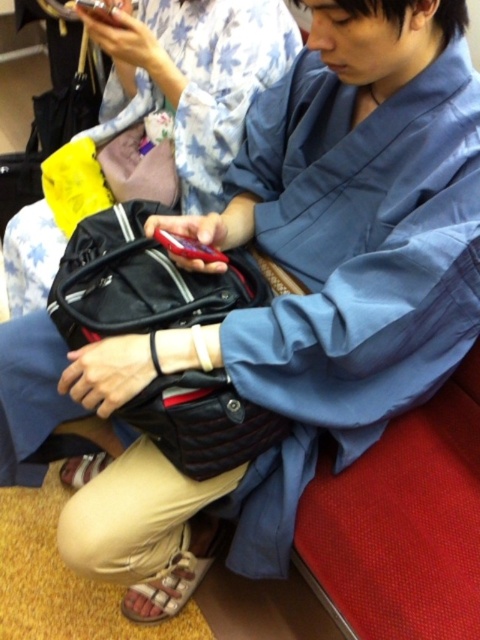
Question: Does matte black bag at center appear on the right side of leather-like black bag at center?

Choices:
 (A) no
 (B) yes

Answer: (A)

Question: Is matte black bag at center smaller than leather-like black bag at center?

Choices:
 (A) no
 (B) yes

Answer: (A)

Question: Which point is farther to the camera?

Choices:
 (A) matte black bag at center
 (B) leather-like black bag at center

Answer: (A)

Question: Is matte black bag at center to the right of leather-like black bag at center from the viewer's perspective?

Choices:
 (A) yes
 (B) no

Answer: (B)

Question: Which of the following is the farthest from the observer?

Choices:
 (A) (56, 250)
 (B) (168, 305)

Answer: (A)

Question: Which point is closer to the camera?

Choices:
 (A) leather-like black bag at center
 (B) matte black bag at center

Answer: (A)